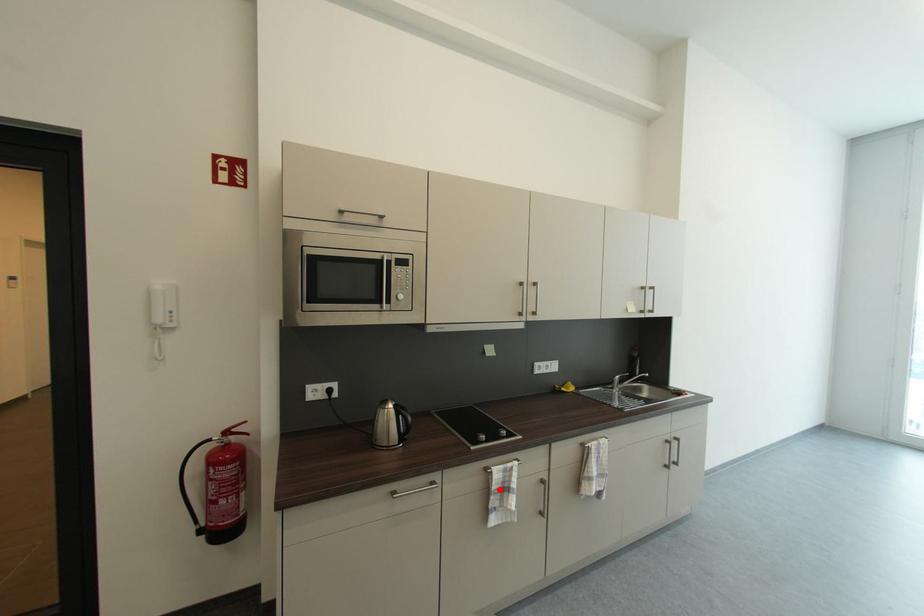
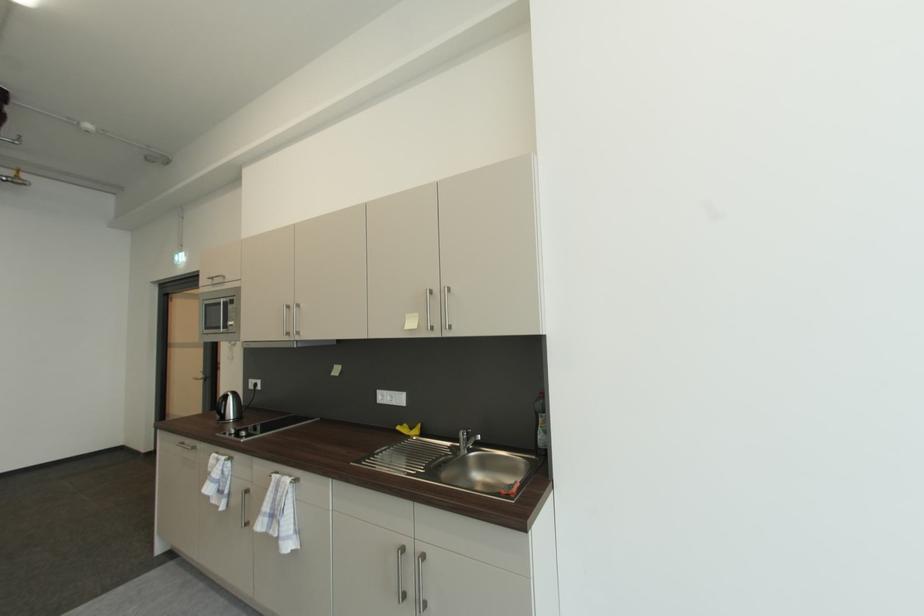
Locate, in the second image, the point that corresponds to the highlighted location in the first image.

(215, 471)